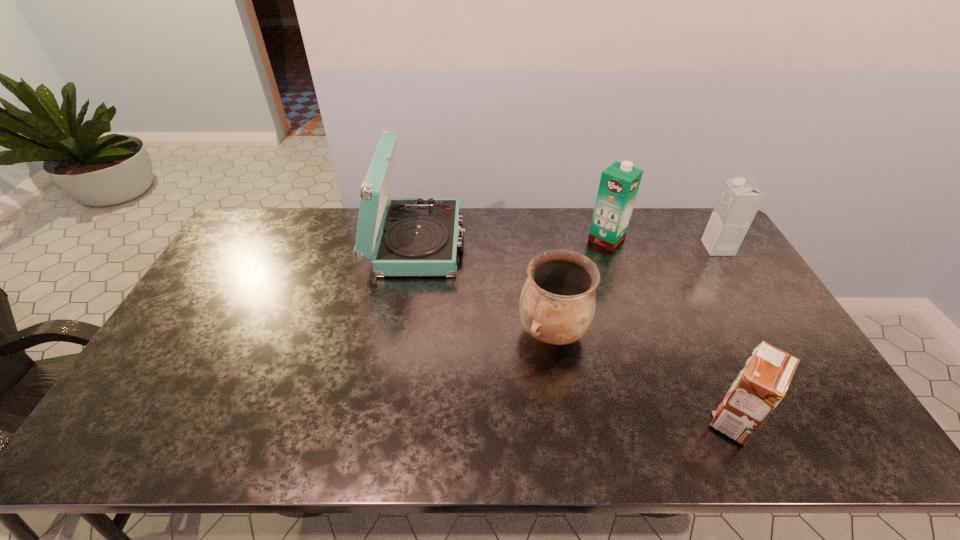
What are the coordinates of `vacant space situated on the front label of the rightmost object` in the screenshot? It's located at (638, 248).

The image size is (960, 540). Find the location of `free space located on the front label of the rightmost object`. free space located on the front label of the rightmost object is located at coordinates (610, 248).

Find the location of a particular element. Image resolution: width=960 pixels, height=540 pixels. vacant space located on the back of the urn is located at coordinates (543, 271).

Identify the location of free space located 0.110m on the straw side of the nearest carton. (660, 418).

Where is `vacant space located 0.190m on the straw side of the nearest carton`? The image size is (960, 540). vacant space located 0.190m on the straw side of the nearest carton is located at coordinates (626, 418).

The width and height of the screenshot is (960, 540). Identify the location of vacant space positioned on the straw side of the nearest carton. (550, 418).

At what (x,y) coordinates should I click in order to perform the action: click on record player positioned at the far edge. Please return your answer as a coordinate pair (x, y). Image resolution: width=960 pixels, height=540 pixels. Looking at the image, I should click on (419, 236).

Locate an element on the screen. object that is at the near edge is located at coordinates 763,382.

I want to click on object located at the right edge, so click(740, 198).

At what (x,y) coordinates should I click in order to perform the action: click on object situated at the far right corner. Please return your answer as a coordinate pair (x, y). Looking at the image, I should click on pos(740,198).